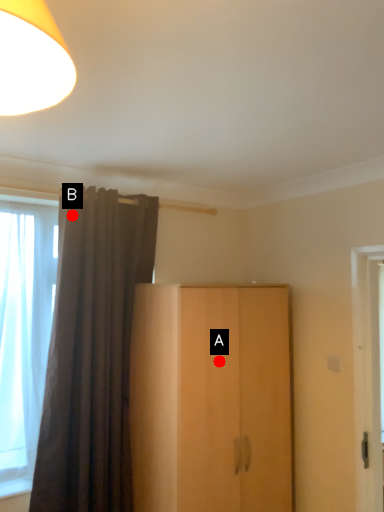
Question: Two points are circled on the image, labeled by A and B beside each circle. Which of the following is the closest to the observer?

Choices:
 (A) A is closer
 (B) B is closer

Answer: (A)